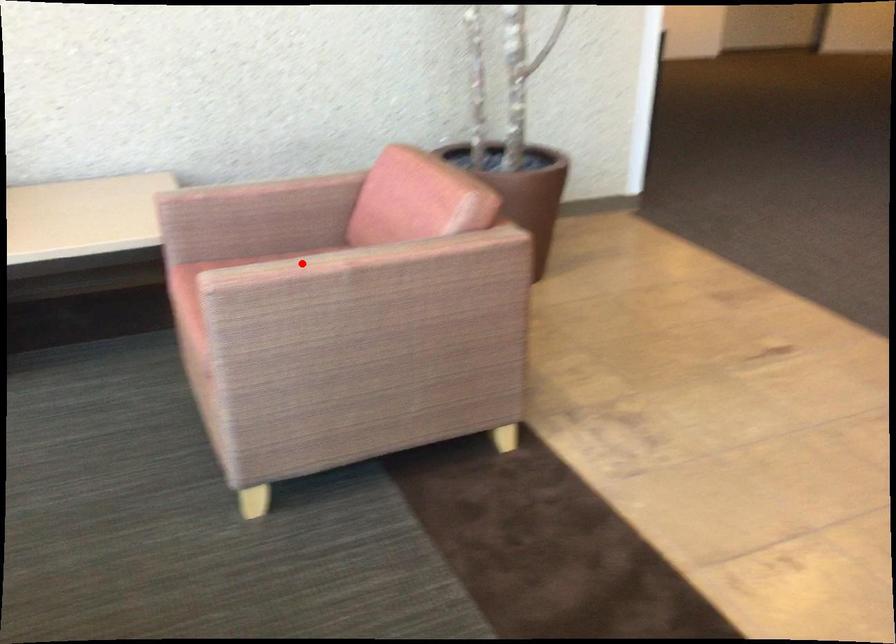
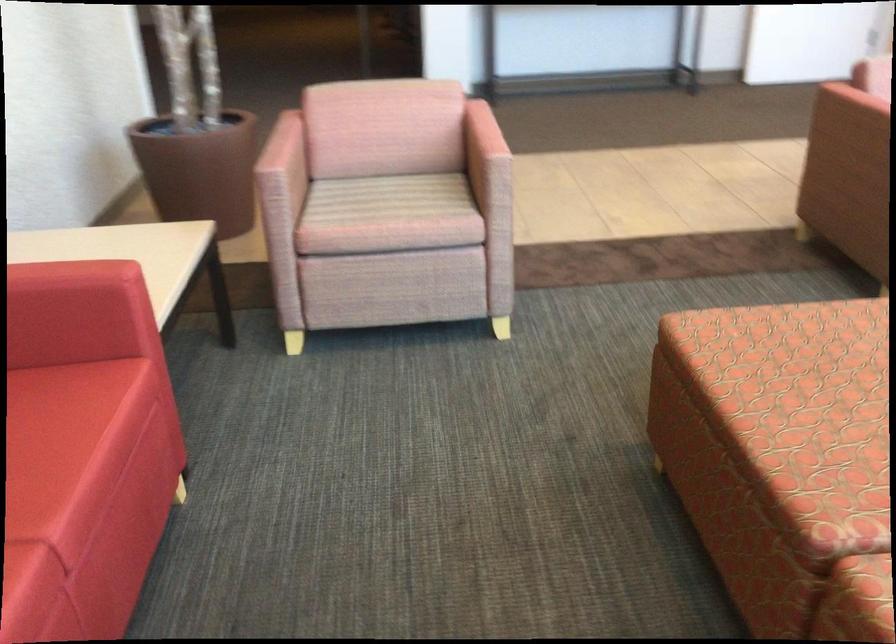
Question: I am providing you with two images of the same scene from different viewpoints. Given a red point in image1, look at the same physical point in image2. Is it:

Choices:
 (A) Closer to the viewpoint
 (B) Farther from the viewpoint

Answer: (B)